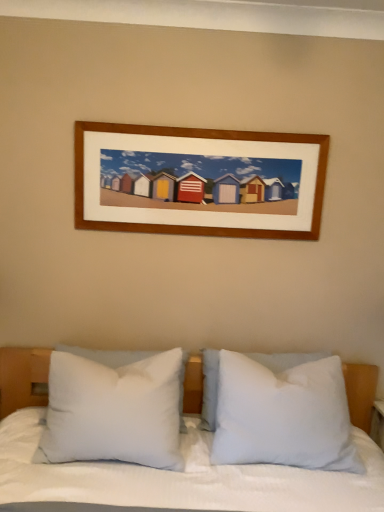
Question: Considering the relative sizes of white soft pillow at center, the 2th pillow positioned from the right, and white soft pillow at center, the third pillow positioned from the right, in the image provided, is white soft pillow at center, the 2th pillow positioned from the right, smaller than white soft pillow at center, the third pillow positioned from the right,?

Choices:
 (A) no
 (B) yes

Answer: (B)

Question: Considering the relative sizes of white soft pillow at center, the 2th pillow positioned from the right, and white soft pillow at center, the third pillow positioned from the right, in the image provided, is white soft pillow at center, the 2th pillow positioned from the right, thinner than white soft pillow at center, the third pillow positioned from the right,?

Choices:
 (A) no
 (B) yes

Answer: (B)

Question: From the image's perspective, is white soft pillow at center, arranged as the 2th pillow when viewed from the left, under white soft pillow at center, the third pillow positioned from the right?

Choices:
 (A) no
 (B) yes

Answer: (B)

Question: Is white soft pillow at center, the 1th pillow when ordered from left to right, at the back of white soft pillow at center, the 2th pillow positioned from the right?

Choices:
 (A) no
 (B) yes

Answer: (A)

Question: From a real-world perspective, is white soft pillow at center, arranged as the 2th pillow when viewed from the left, below white soft pillow at center, the third pillow positioned from the right?

Choices:
 (A) no
 (B) yes

Answer: (B)

Question: Does point (124, 432) appear closer or farther from the camera than point (211, 390)?

Choices:
 (A) farther
 (B) closer

Answer: (B)

Question: Is white soft pillow at center, the third pillow positioned from the right, in front of or behind white soft pillow at center, arranged as the 2th pillow when viewed from the left, in the image?

Choices:
 (A) front
 (B) behind

Answer: (A)

Question: Choose the correct answer: Is white soft pillow at center, the third pillow positioned from the right, inside white soft pillow at center, the 2th pillow positioned from the right, or outside it?

Choices:
 (A) outside
 (B) inside

Answer: (A)

Question: Considering the relative positions of white soft pillow at center, the third pillow positioned from the right, and white soft pillow at center, arranged as the 2th pillow when viewed from the left, in the image provided, is white soft pillow at center, the third pillow positioned from the right, to the left or to the right of white soft pillow at center, arranged as the 2th pillow when viewed from the left,?

Choices:
 (A) left
 (B) right

Answer: (A)

Question: Relative to white soft pillow at center, arranged as the 3th pillow when viewed from the left, is white soft pillow at center, the 2th pillow positioned from the right, in front or behind?

Choices:
 (A) behind
 (B) front

Answer: (A)

Question: Is point (210, 410) positioned closer to the camera than point (221, 448)?

Choices:
 (A) farther
 (B) closer

Answer: (A)

Question: Considering the positions of white soft pillow at center, arranged as the 2th pillow when viewed from the left, and white soft pillow at center, the 1th pillow in the right-to-left sequence, in the image, is white soft pillow at center, arranged as the 2th pillow when viewed from the left, bigger or smaller than white soft pillow at center, the 1th pillow in the right-to-left sequence,?

Choices:
 (A) small
 (B) big

Answer: (A)

Question: From the image's perspective, is white soft pillow at center, the 2th pillow positioned from the right, above or below white soft pillow at center, arranged as the 3th pillow when viewed from the left?

Choices:
 (A) above
 (B) below

Answer: (A)

Question: Considering the positions of point (218, 399) and point (102, 387), is point (218, 399) closer or farther from the camera than point (102, 387)?

Choices:
 (A) farther
 (B) closer

Answer: (A)

Question: From a real-world perspective, relative to white soft pillow at center, the third pillow positioned from the right, is white soft pillow at center, the 1th pillow in the right-to-left sequence, vertically above or below?

Choices:
 (A) above
 (B) below

Answer: (B)